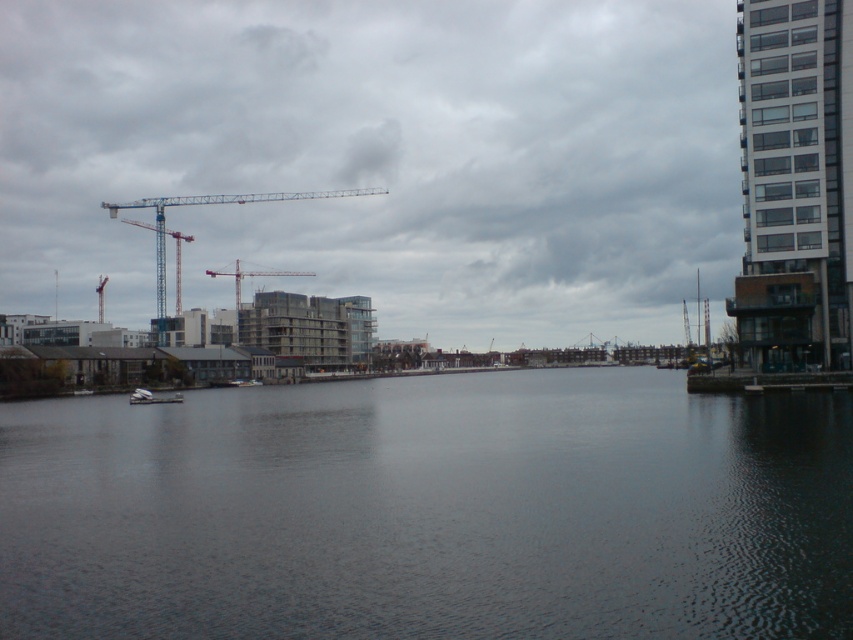
Question: Is dark gray water at center bigger than white matte boat at center?

Choices:
 (A) yes
 (B) no

Answer: (A)

Question: Which of the following is the closest to the observer?

Choices:
 (A) white matte boat at center
 (B) metallic blue crane at center-left
 (C) dark gray water at center

Answer: (C)

Question: Does dark gray water at center appear on the right side of metallic blue crane at center-left?

Choices:
 (A) yes
 (B) no

Answer: (A)

Question: Which of the following is the farthest from the observer?

Choices:
 (A) white matte boat at center
 (B) dark gray water at center
 (C) metallic blue crane at center-left

Answer: (C)

Question: Is dark gray water at center thinner than metallic blue crane at center-left?

Choices:
 (A) yes
 (B) no

Answer: (A)

Question: Which point appears farthest from the camera in this image?

Choices:
 (A) (161, 243)
 (B) (149, 392)
 (C) (579, 586)

Answer: (A)